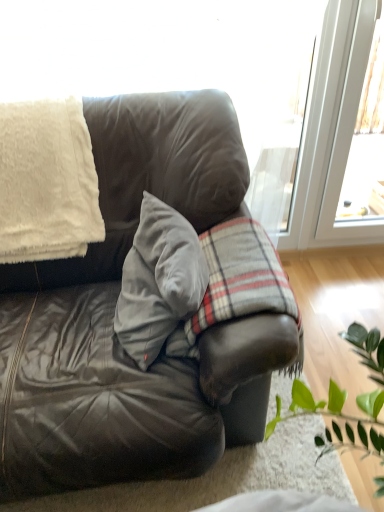
Question: Is velvet gray pillow at center placed right next to white fluffy blanket at upper left?

Choices:
 (A) no
 (B) yes

Answer: (A)

Question: Can you confirm if velvet gray pillow at center is wider than white fluffy blanket at upper left?

Choices:
 (A) no
 (B) yes

Answer: (A)

Question: Is velvet gray pillow at center shorter than white fluffy blanket at upper left?

Choices:
 (A) no
 (B) yes

Answer: (B)

Question: Can you confirm if velvet gray pillow at center is positioned to the left of white fluffy blanket at upper left?

Choices:
 (A) no
 (B) yes

Answer: (A)

Question: From a real-world perspective, is velvet gray pillow at center physically above white fluffy blanket at upper left?

Choices:
 (A) no
 (B) yes

Answer: (A)

Question: Is there a large distance between velvet gray pillow at center and white fluffy blanket at upper left?

Choices:
 (A) no
 (B) yes

Answer: (A)

Question: Does white fluffy blanket at upper left come behind leather couch at center?

Choices:
 (A) no
 (B) yes

Answer: (B)

Question: Considering the relative sizes of white fluffy blanket at upper left and leather couch at center in the image provided, is white fluffy blanket at upper left wider than leather couch at center?

Choices:
 (A) yes
 (B) no

Answer: (B)

Question: Could you tell me if white fluffy blanket at upper left is turned towards leather couch at center?

Choices:
 (A) yes
 (B) no

Answer: (A)

Question: Can you confirm if white fluffy blanket at upper left is taller than leather couch at center?

Choices:
 (A) no
 (B) yes

Answer: (A)

Question: Does white fluffy blanket at upper left have a larger size compared to leather couch at center?

Choices:
 (A) yes
 (B) no

Answer: (B)

Question: From the image's perspective, is white fluffy blanket at upper left located beneath leather couch at center?

Choices:
 (A) no
 (B) yes

Answer: (A)

Question: Is plaid fabric at center turned away from velvet gray pillow at center?

Choices:
 (A) yes
 (B) no

Answer: (A)